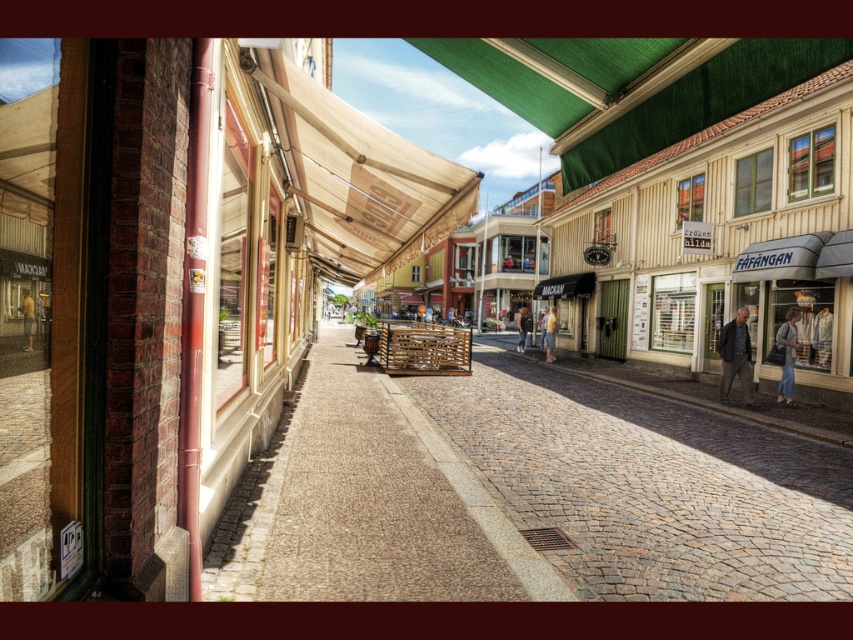
Is point (587, 397) positioned in front of point (546, 323)?

Yes, point (587, 397) is in front of point (546, 323).

Is brown cobblestone at center taller than light blue denim jeans at center?

No.

Locate an element on the screen. Image resolution: width=853 pixels, height=640 pixels. brown cobblestone at center is located at coordinates (524, 493).

At what (x,y) coordinates should I click in order to perform the action: click on brown cobblestone at center. Please return your answer as a coordinate pair (x, y). Looking at the image, I should click on click(524, 493).

What do you see at coordinates (735, 356) in the screenshot? I see `dark gray suit at right` at bounding box center [735, 356].

Is dark gray suit at right shorter than yellow t-shirt at center?

No.

Is point (724, 346) closer to viewer compared to point (32, 320)?

No, it is not.

Locate an element on the screen. dark gray suit at right is located at coordinates (735, 356).

Which is more to the right, brown cobblestone at center or beige fabric canopy at center?

brown cobblestone at center is more to the right.

Does brown cobblestone at center come behind beige fabric canopy at center?

No.

The height and width of the screenshot is (640, 853). Find the location of `brown cobblestone at center`. brown cobblestone at center is located at coordinates (524, 493).

What are the coordinates of `brown cobblestone at center` in the screenshot? It's located at (524, 493).